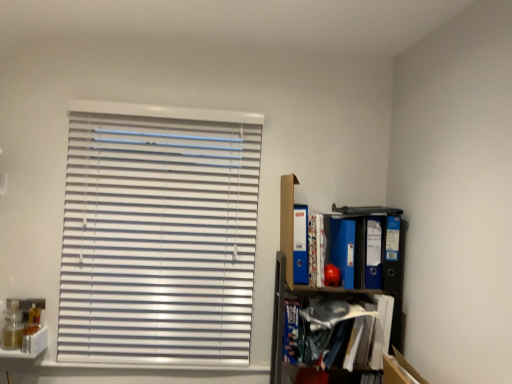
Question: Is blue matte book at lower right, placed as the second book when sorted from right to left, aimed at blue matte folder at upper right, which is the 4th paperback book in right-to-left order?

Choices:
 (A) no
 (B) yes

Answer: (A)

Question: Are blue matte book at lower right, which appears as the 1th book when ordered from the bottom, and blue matte folder at upper right, which is the 4th paperback book in right-to-left order, beside each other?

Choices:
 (A) yes
 (B) no

Answer: (B)

Question: From the image's perspective, is blue matte book at lower right, which is the first book in left-to-right order, above blue matte folder at upper right, the 1th paperback book when ordered from left to right?

Choices:
 (A) yes
 (B) no

Answer: (B)

Question: Considering the relative sizes of blue matte book at lower right, which ranks as the 2th book in top-to-bottom order, and blue matte folder at upper right, which is the 4th paperback book in right-to-left order, in the image provided, is blue matte book at lower right, which ranks as the 2th book in top-to-bottom order, taller than blue matte folder at upper right, which is the 4th paperback book in right-to-left order,?

Choices:
 (A) no
 (B) yes

Answer: (A)

Question: From a real-world perspective, is blue matte book at lower right, placed as the second book when sorted from right to left, positioned under blue matte folder at upper right, which is the 4th paperback book in right-to-left order, based on gravity?

Choices:
 (A) no
 (B) yes

Answer: (B)

Question: Is patterned paper book at upper right, the 1th book from the right, wider or thinner than blue glossy folder at right, the 4th paperback book from the left?

Choices:
 (A) wide
 (B) thin

Answer: (B)

Question: Based on their sizes in the image, would you say patterned paper book at upper right, which is the first book in top-to-bottom order, is bigger or smaller than blue glossy folder at right, the 4th paperback book from the left?

Choices:
 (A) small
 (B) big

Answer: (A)

Question: From a real-world perspective, is patterned paper book at upper right, the 1th book from the right, above or below blue glossy folder at right, the 1th paperback book from the right?

Choices:
 (A) below
 (B) above

Answer: (A)

Question: From the image's perspective, is patterned paper book at upper right, the second book when ordered from bottom to top, located above or below blue glossy folder at right, the 4th paperback book from the left?

Choices:
 (A) below
 (B) above

Answer: (B)

Question: Choose the correct answer: Is blue matte folder at right, positioned as the 2th paperback book in right-to-left order, inside blue matte folder at upper right, the 1th paperback book when ordered from left to right, or outside it?

Choices:
 (A) outside
 (B) inside

Answer: (A)

Question: Considering the positions of point (367, 259) and point (294, 253), is point (367, 259) closer or farther from the camera than point (294, 253)?

Choices:
 (A) farther
 (B) closer

Answer: (A)

Question: From a real-world perspective, is blue matte folder at right, positioned as the 2th paperback book in right-to-left order, above or below blue matte folder at upper right, which is the 4th paperback book in right-to-left order?

Choices:
 (A) below
 (B) above

Answer: (A)

Question: From the image's perspective, is blue matte folder at right, placed as the 3th paperback book when sorted from left to right, above or below blue matte folder at upper right, which is the 4th paperback book in right-to-left order?

Choices:
 (A) below
 (B) above

Answer: (A)

Question: In the image, is blue glossy folder at right, the 1th paperback book from the right, positioned in front of or behind blue matte book at lower right, which ranks as the 2th book in top-to-bottom order?

Choices:
 (A) behind
 (B) front

Answer: (A)

Question: In terms of height, does blue glossy folder at right, the 1th paperback book from the right, look taller or shorter compared to blue matte book at lower right, which is the first book in left-to-right order?

Choices:
 (A) tall
 (B) short

Answer: (A)